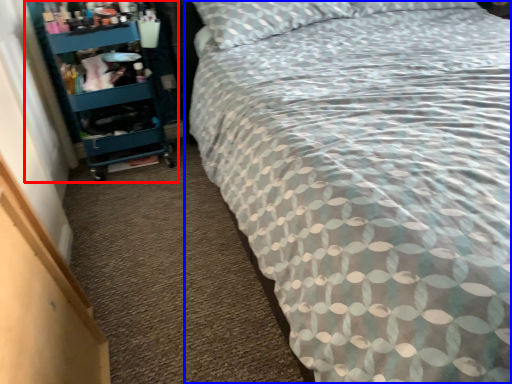
Question: Among these objects, which one is nearest to the camera, shelf (highlighted by a red box) or bed (highlighted by a blue box)?

Choices:
 (A) shelf
 (B) bed

Answer: (B)